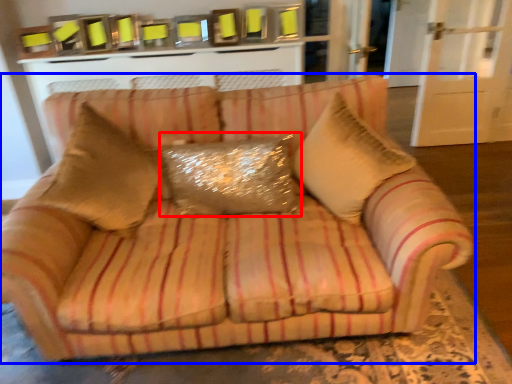
Question: Which point is closer to the camera, pillow (highlighted by a red box) or studio couch (highlighted by a blue box)?

Choices:
 (A) pillow
 (B) studio couch

Answer: (B)